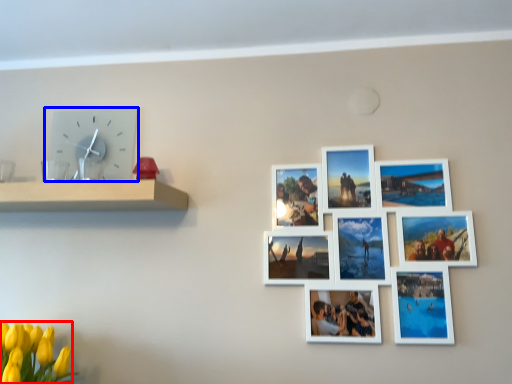
Question: Which of the following is the farthest to the observer, flower (highlighted by a red box) or wall clock (highlighted by a blue box)?

Choices:
 (A) flower
 (B) wall clock

Answer: (B)